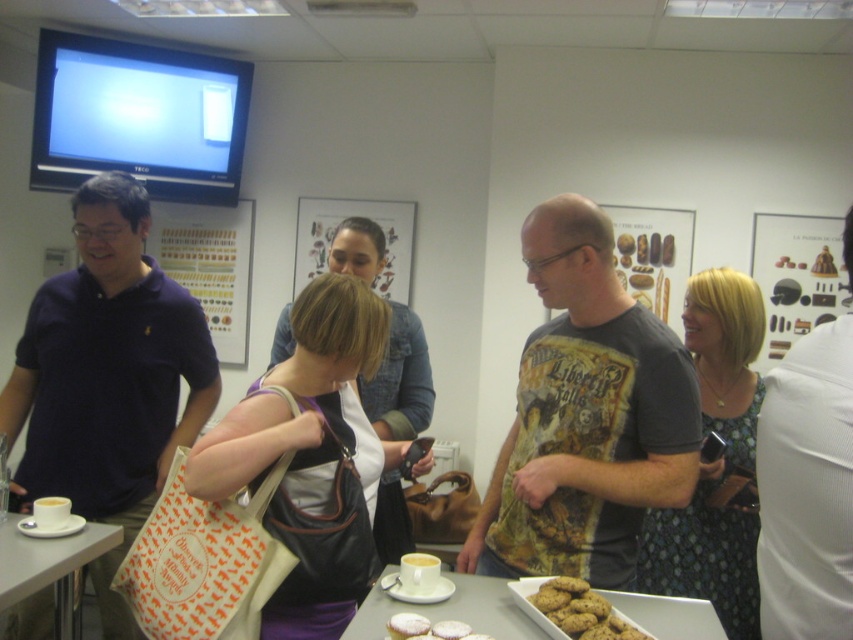
Question: Does dark blue polo shirt at left have a lesser width compared to white fabric shirt at right?

Choices:
 (A) no
 (B) yes

Answer: (A)

Question: Does dark blue polo shirt at left have a greater width compared to white fabric shirt at right?

Choices:
 (A) no
 (B) yes

Answer: (B)

Question: Is dark blue polo shirt at left positioned at the back of white glossy table at lower center?

Choices:
 (A) no
 (B) yes

Answer: (B)

Question: Estimate the real-world distances between objects in this image. Which object is closer to the dark blue polo shirt at left?

Choices:
 (A) dark gray t-shirt at center
 (B) white glossy table at lower left

Answer: (B)

Question: Among these objects, which one is farthest from the camera?

Choices:
 (A) brown crumbly cookie at center
 (B) dark blue polo shirt at left
 (C) white glossy table at lower left
 (D) white fabric shirt at right

Answer: (B)

Question: Which object appears closest to the camera in this image?

Choices:
 (A) dark blue polo shirt at left
 (B) white glossy table at lower left
 (C) white fabric shirt at right
 (D) white glossy table at lower center

Answer: (C)